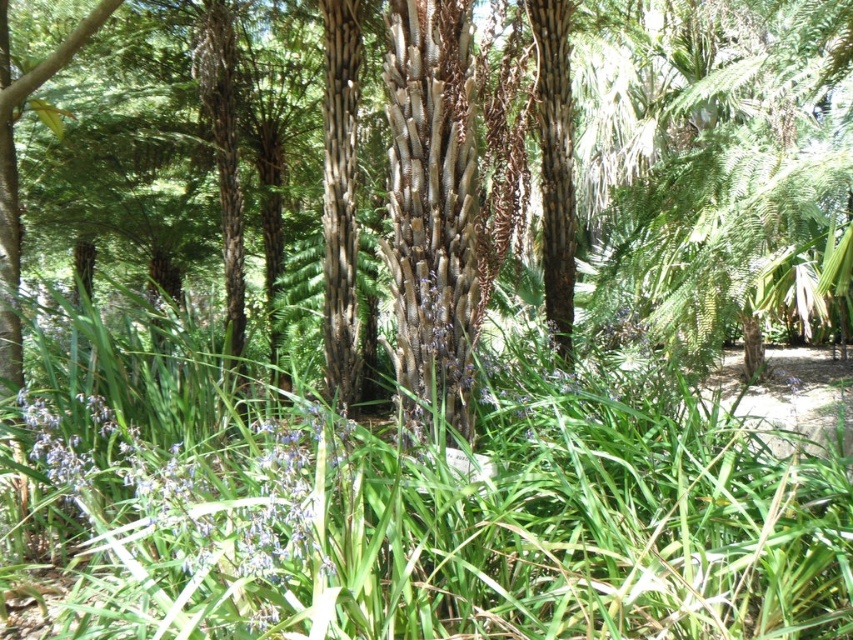
Question: Observing the image, what is the correct spatial positioning of green leafy grass at center in reference to textured bark palm tree at center?

Choices:
 (A) left
 (B) right

Answer: (A)

Question: Does green leafy grass at center have a lesser width compared to textured bark palm tree at center?

Choices:
 (A) yes
 (B) no

Answer: (A)

Question: Which of the following is the closest to the observer?

Choices:
 (A) (688, 554)
 (B) (550, 145)

Answer: (A)

Question: Which point appears closest to the camera in this image?

Choices:
 (A) (288, 499)
 (B) (802, 12)

Answer: (A)

Question: Which point is farther from the camera taking this photo?

Choices:
 (A) click(486, 132)
 (B) click(598, 422)

Answer: (A)

Question: From the image, what is the correct spatial relationship of green leafy grass at center in relation to textured bark palm tree at center?

Choices:
 (A) left
 (B) right

Answer: (A)